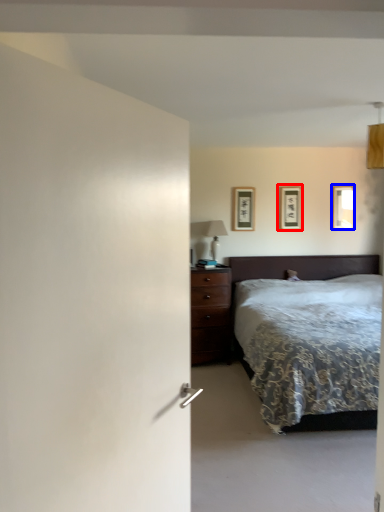
Question: Among these objects, which one is nearest to the camera, picture frame (highlighted by a red box) or picture frame (highlighted by a blue box)?

Choices:
 (A) picture frame
 (B) picture frame

Answer: (A)